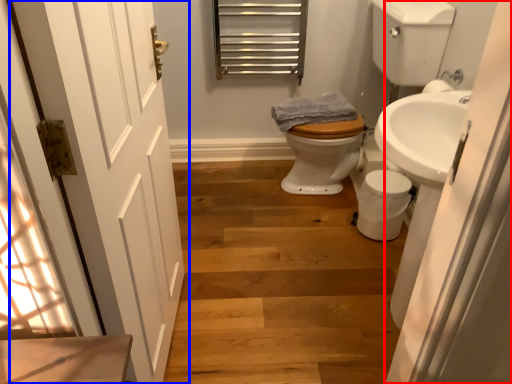
Question: Which object is closer to the camera taking this photo, screen door (highlighted by a red box) or door (highlighted by a blue box)?

Choices:
 (A) screen door
 (B) door

Answer: (B)